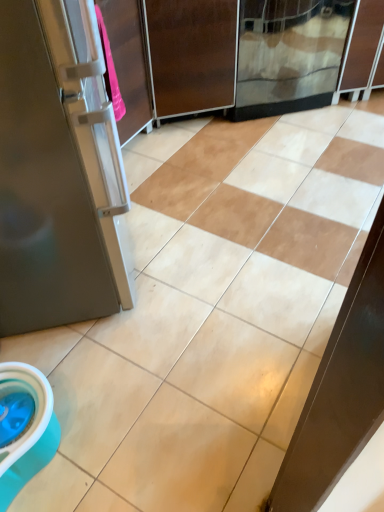
Question: From the image's perspective, is brown matte screen door at center, arranged as the 2th screen door when viewed from the right, above or below transparent glass screen door at upper center, the 1th screen door positioned from the right?

Choices:
 (A) above
 (B) below

Answer: (B)

Question: From a real-world perspective, is brown matte screen door at center, arranged as the 2th screen door when viewed from the right, physically located above or below transparent glass screen door at upper center, the 1th screen door positioned from the right?

Choices:
 (A) below
 (B) above

Answer: (B)

Question: Relative to transparent glass screen door at upper center, the 2th screen door from the left, is brown matte screen door at center, arranged as the 2th screen door when viewed from the right, in front or behind?

Choices:
 (A) behind
 (B) front

Answer: (B)

Question: From a real-world perspective, is transparent glass screen door at upper center, the 1th screen door positioned from the right, positioned above or below brown matte screen door at center, placed as the 1th screen door when sorted from left to right?

Choices:
 (A) above
 (B) below

Answer: (B)

Question: Considering the positions of point (291, 103) and point (225, 68), is point (291, 103) closer or farther from the camera than point (225, 68)?

Choices:
 (A) closer
 (B) farther

Answer: (B)

Question: In the image, is transparent glass screen door at upper center, the 1th screen door positioned from the right, positioned in front of or behind brown matte screen door at center, placed as the 1th screen door when sorted from left to right?

Choices:
 (A) front
 (B) behind

Answer: (B)

Question: Is transparent glass screen door at upper center, the 1th screen door positioned from the right, situated inside brown matte screen door at center, placed as the 1th screen door when sorted from left to right, or outside?

Choices:
 (A) inside
 (B) outside

Answer: (B)